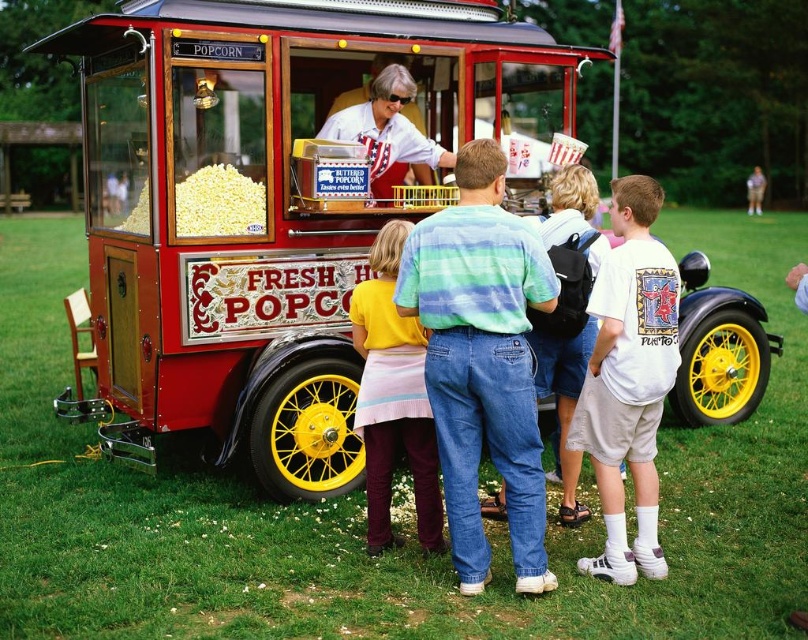
Question: Which point appears farthest from the camera in this image?

Choices:
 (A) (464, 156)
 (B) (381, 276)
 (C) (638, 323)

Answer: (B)

Question: Is red polished wood popcorn cart at center thinner than denim jeans at center?

Choices:
 (A) no
 (B) yes

Answer: (A)

Question: Which object appears closest to the camera in this image?

Choices:
 (A) yellow cotton shirt at center
 (B) denim jeans at center

Answer: (B)

Question: Where is red polished wood popcorn cart at center located in relation to white cotton t-shirt at center in the image?

Choices:
 (A) right
 (B) left

Answer: (B)

Question: Which of the following is the farthest from the observer?

Choices:
 (A) (546, 88)
 (B) (436, 522)
 (C) (632, 564)

Answer: (A)

Question: From the image, what is the correct spatial relationship of red polished wood popcorn cart at center in relation to denim jeans at center?

Choices:
 (A) right
 (B) left

Answer: (B)